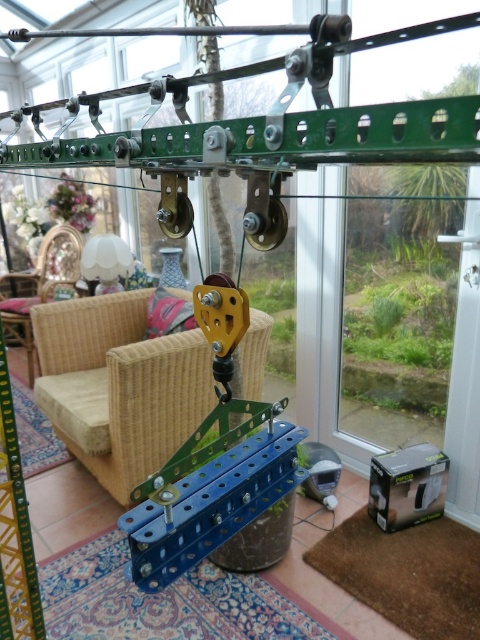
Which is behind, point (165, 440) or point (41, 259)?

The point (41, 259) is more distant.

Between rattan armchair at center and wicker armchair at center, which one appears on the left side from the viewer's perspective?

Positioned to the left is wicker armchair at center.

Which is behind, point (115, 445) or point (16, 301)?

The point (16, 301) is behind.

At what (x,y) coordinates should I click in order to perform the action: click on rattan armchair at center. Please return your answer as a coordinate pair (x, y). The height and width of the screenshot is (640, 480). Looking at the image, I should click on (119, 385).

Does point (217, 419) come farther from viewer compared to point (49, 298)?

No, it is in front of (49, 298).

Looking at this image, does metallic blue pulley at center have a larger size compared to wicker armchair at center?

Incorrect, metallic blue pulley at center is not larger than wicker armchair at center.

The height and width of the screenshot is (640, 480). Identify the location of metallic blue pulley at center. (212, 461).

Which is more to the right, rattan armchair at center or metallic blue pulley at center?

Positioned to the right is metallic blue pulley at center.

Is rattan armchair at center further to camera compared to metallic blue pulley at center?

That is True.

Is point (113, 493) less distant than point (261, 502)?

No, it is behind (261, 502).

You are a GUI agent. You are given a task and a screenshot of the screen. Output one action in this format:
    pyautogui.click(x=<x>, y=<y>)
    Task: Click on the rattan armchair at center
    
    Given the screenshot: What is the action you would take?
    pyautogui.click(x=119, y=385)